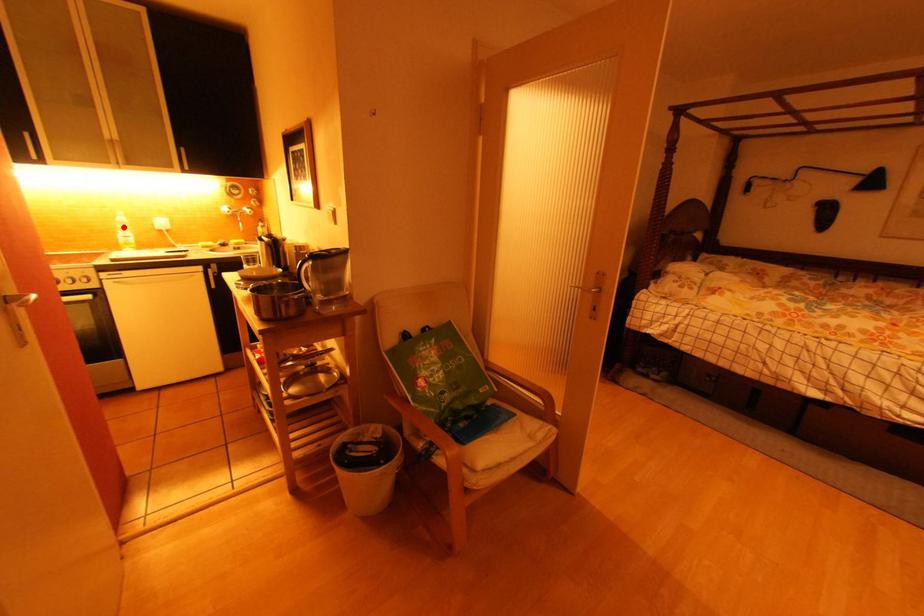
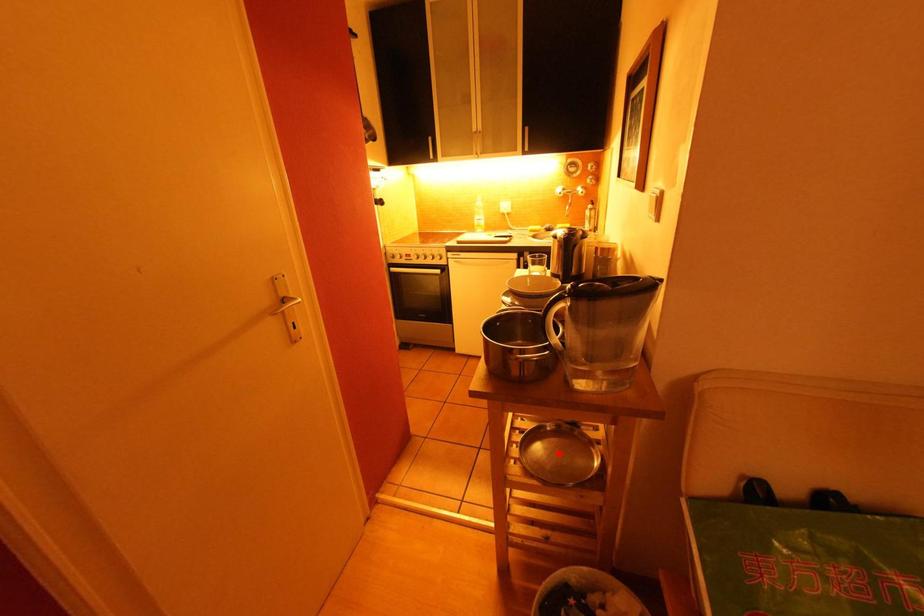
I am providing you with two images of the same scene from different viewpoints. A red point is marked on the first image and another point is marked on the second image. Is the marked point in image1 the same physical position as the marked point in image2?

No